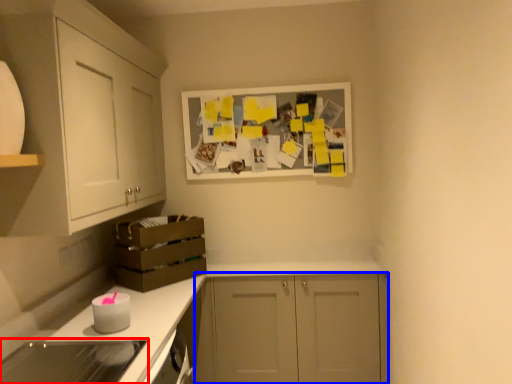
Question: Which of the following is the farthest to the observer, appliance (highlighted by a red box) or cabinetry (highlighted by a blue box)?

Choices:
 (A) appliance
 (B) cabinetry

Answer: (B)